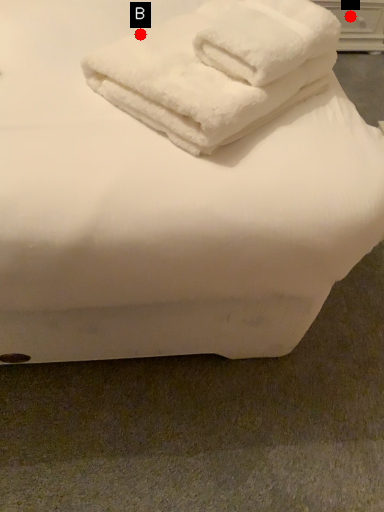
Question: Two points are circled on the image, labeled by A and B beside each circle. Which point is closer to the camera?

Choices:
 (A) A is closer
 (B) B is closer

Answer: (B)